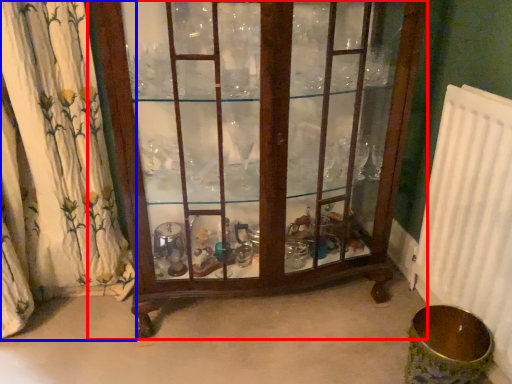
Question: Which object is further to the camera taking this photo, furniture (highlighted by a red box) or curtain (highlighted by a blue box)?

Choices:
 (A) furniture
 (B) curtain

Answer: (B)